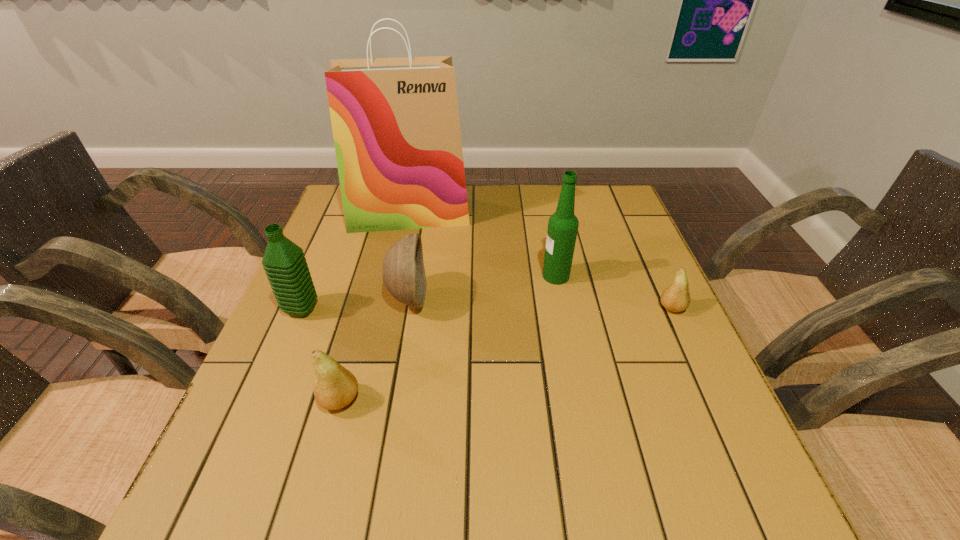
This screenshot has width=960, height=540. Find the location of `vacant position for inserting another pear evenly`. vacant position for inserting another pear evenly is located at coordinates (522, 349).